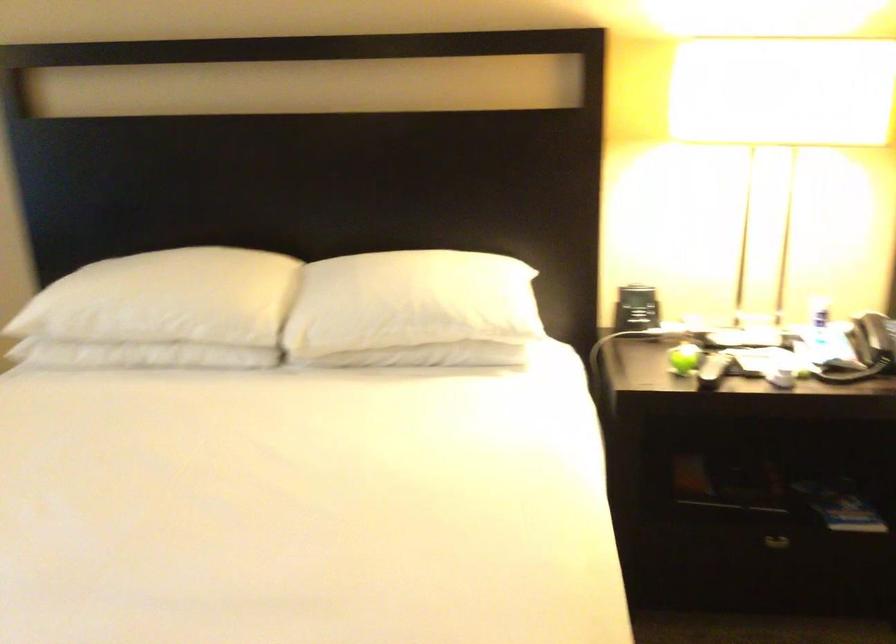
The location [819,319] corresponds to which object?

This point indicates the small white bottle.